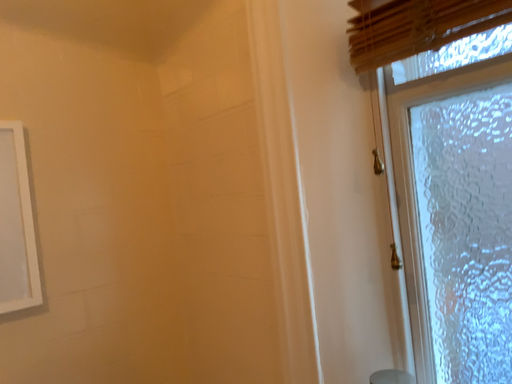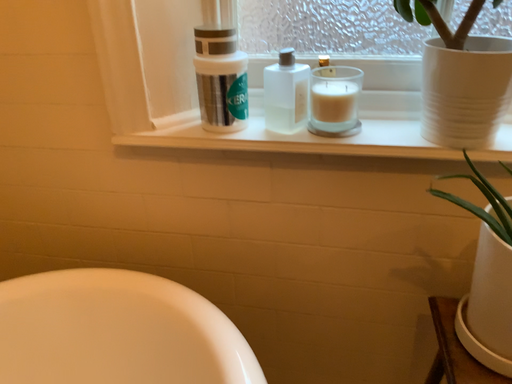
Question: Which way did the camera rotate in the video?

Choices:
 (A) rotated left
 (B) rotated right

Answer: (B)